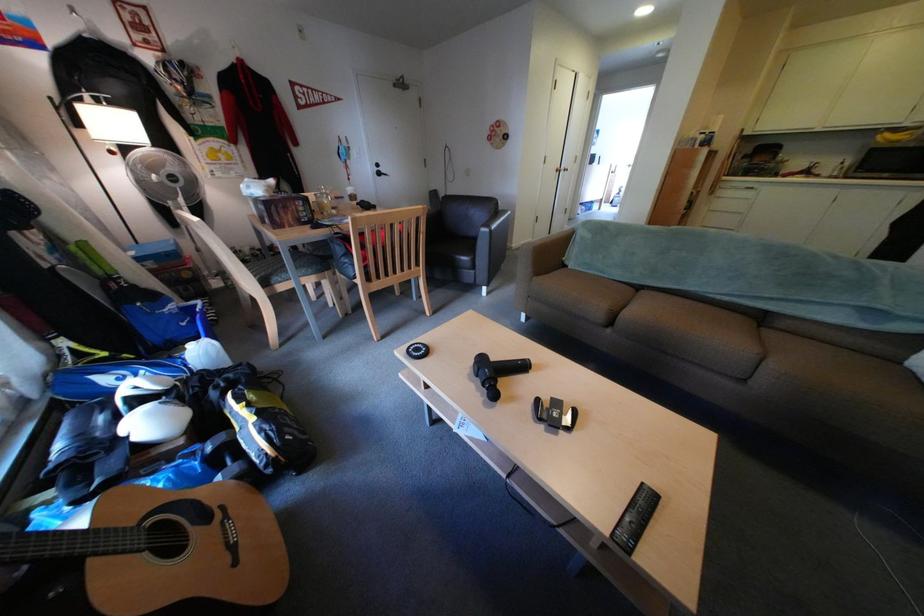
Where would you resting on the chair armrest? Please return your answer as a coordinate pair (x, y).

(478, 273)